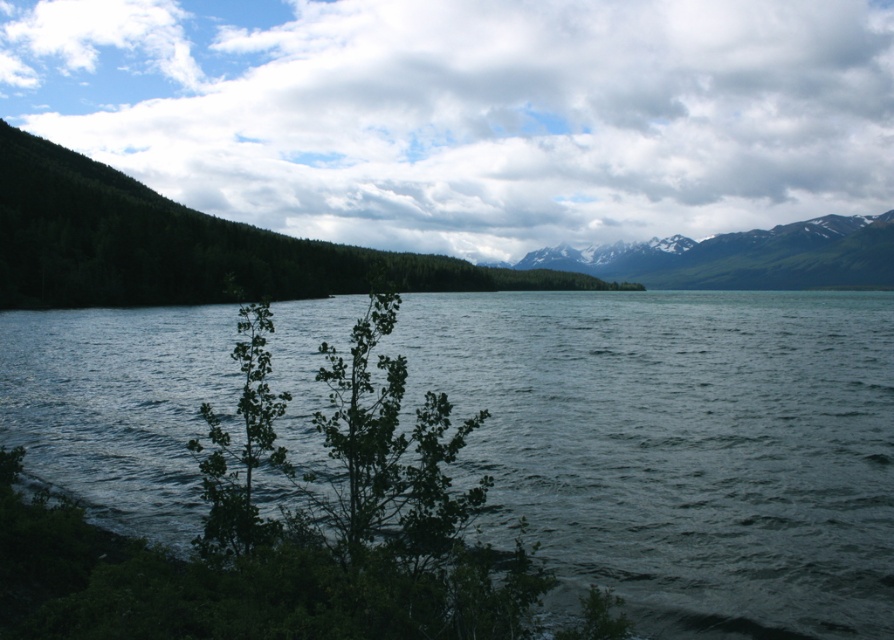
Who is more forward, (661, 448) or (890, 212)?

Point (661, 448) is in front.

Find the location of `greenish-blue water at center`. greenish-blue water at center is located at coordinates (679, 448).

This screenshot has width=894, height=640. Identify the location of greenish-blue water at center. (679, 448).

Is white fluffy cloud at upper center below snowy granite mountains at upper right?

No, white fluffy cloud at upper center is not below snowy granite mountains at upper right.

Is point (721, 42) more distant than point (822, 253)?

Yes, it is.

Is point (49, 40) in front of point (844, 280)?

No, it is not.

You are a GUI agent. You are given a task and a screenshot of the screen. Output one action in this format:
    pyautogui.click(x=<x>, y=<y>)
    Task: Click on the white fluffy cloud at upper center
    
    Given the screenshot: What is the action you would take?
    pyautogui.click(x=470, y=113)

From the picture: Is greenish-blue water at center below green leafy tree at left?

Indeed, greenish-blue water at center is positioned under green leafy tree at left.

Between greenish-blue water at center and green leafy tree at left, which one appears on the left side from the viewer's perspective?

green leafy tree at left

Who is more distant from viewer, (479, 464) or (155, 248)?

Point (155, 248)

Locate an element on the screen. The width and height of the screenshot is (894, 640). greenish-blue water at center is located at coordinates 679,448.